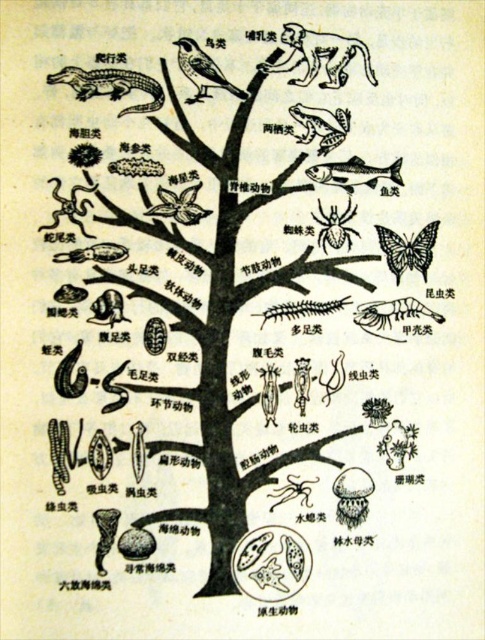
Looking at this image, based on the tree diagram, which animal group is located at the coordinate point (110, 84)?

The point (110, 84) marks the greenish brown scaly crocodile at upper left.

Based on the black line drawing tree at center, which major animal group is positioned at the coordinates point (222, 336)?

The black line drawing tree at center is located at point (222, 336), so the major animal group at those coordinates is the trunk of the tree, which represents the central classification point before branching into specific groups like vertebrates, arthropods, and mollusks.